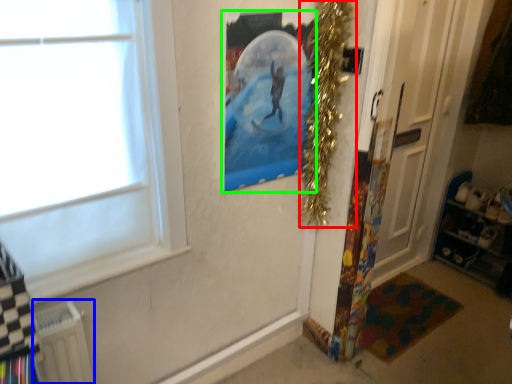
Question: Which is farther away from christmas decoration (highlighted by a red box)? radiator (highlighted by a blue box) or picture frame (highlighted by a green box)?

Choices:
 (A) radiator
 (B) picture frame

Answer: (A)